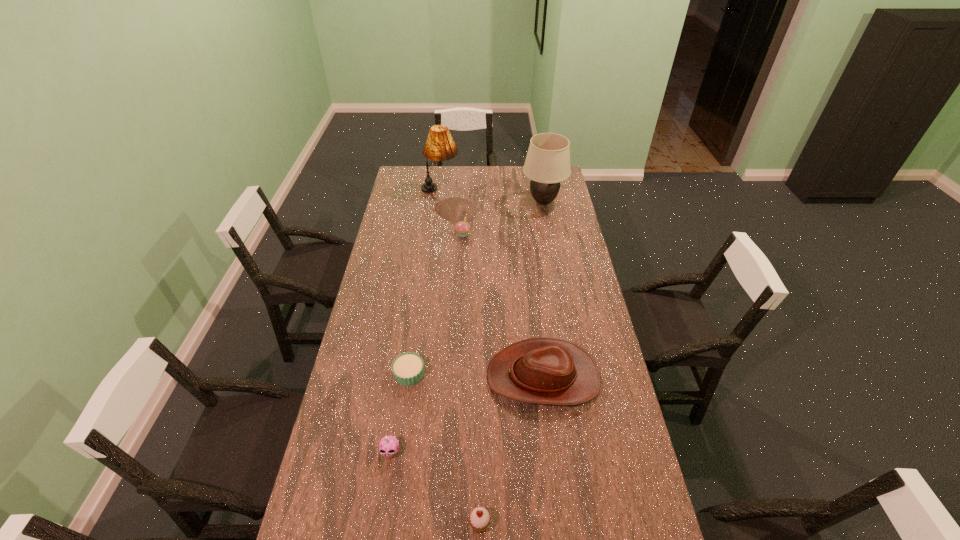
You are a GUI agent. You are given a task and a screenshot of the screen. Output one action in this format:
    pyautogui.click(x=<x>, y=<y>)
    Task: Click on the lampshade present at the left edge
    The width and height of the screenshot is (960, 540).
    Given the screenshot: What is the action you would take?
    pyautogui.click(x=440, y=146)

Where is `cupcake present at the left edge`? The height and width of the screenshot is (540, 960). cupcake present at the left edge is located at coordinates (407, 368).

Identify the location of lampshade at the right edge. 547,163.

Find the location of `cowboy hat that is at the right edge`. cowboy hat that is at the right edge is located at coordinates (549, 371).

Where is `object present at the far left corner`? object present at the far left corner is located at coordinates (440, 146).

In the image, there is a desktop. Where is `free region at the left edge`? The width and height of the screenshot is (960, 540). free region at the left edge is located at coordinates (380, 254).

At what (x,y) coordinates should I click in order to perform the action: click on vacant area at the right edge of the desktop. Please return your answer as a coordinate pair (x, y). This screenshot has width=960, height=540. Looking at the image, I should click on (590, 296).

Locate an element on the screen. The width and height of the screenshot is (960, 540). free space at the far left corner of the desktop is located at coordinates (396, 184).

I want to click on vacant area that lies between the shortest cupcake and the rightmost cupcake, so click(x=444, y=450).

This screenshot has height=540, width=960. In order to click on free space between the shortest object and the sixth farthest object in this screenshot , I will do `click(400, 414)`.